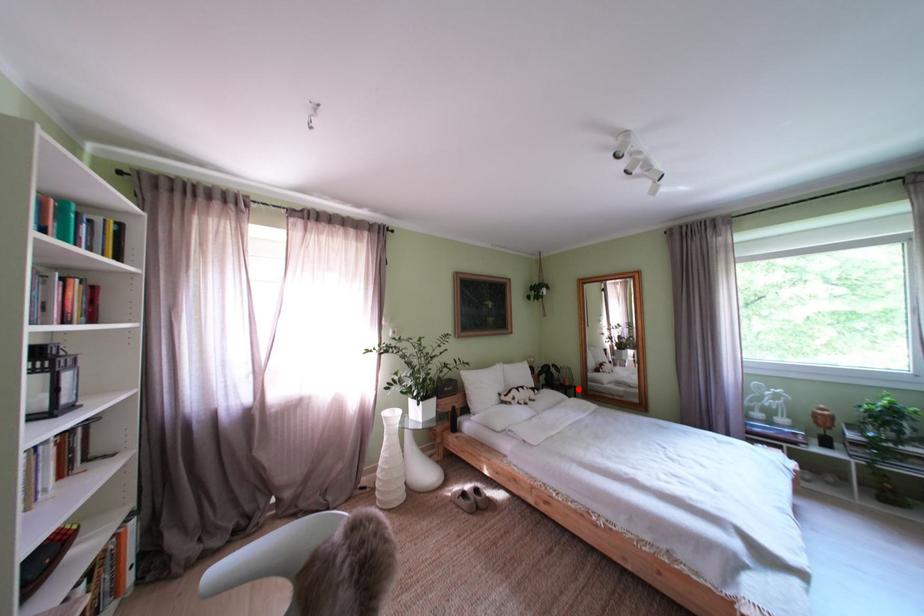
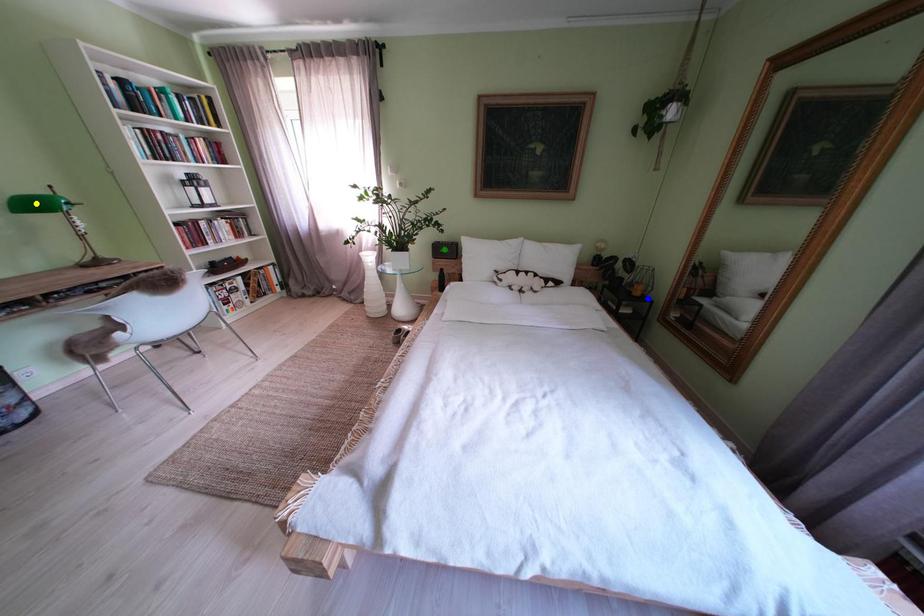
Question: I am providing you with two images of the same scene from different viewpoints. A red point is marked on the first image. You are given multiple points on the second image. Can you choose the point in image 2 that corresponds to the point in image 1?

Choices:
 (A) yellow point
 (B) green point
 (C) blue point

Answer: (C)